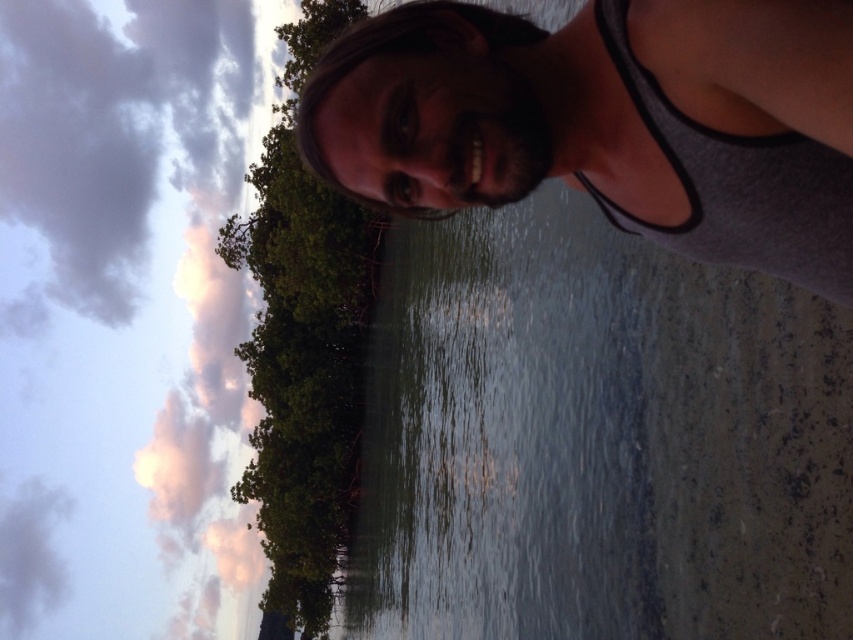
You are an artist trying to paint the sunset scene. You want to ensure the pink fluffy cloud at upper left and the green leafy tree at center are proportionally accurate. Which object should you draw larger?

The pink fluffy cloud at upper left should be drawn larger than the green leafy tree at center because it is bigger according to the description.

You are an astronomer observing the sky and notice the pink fluffy cloud at upper left and the gray fabric tank top at upper center. Which object is closer to your line of sight?

The pink fluffy cloud at upper left is closer to your line of sight because the gray fabric tank top at upper center is behind it.

You are an artist trying to paint the serene outdoor scene. You notice the gray fabric tank top at upper center and the green leafy tree at center. Which object should you draw first if you want to follow the rule of painting smaller objects before larger ones?

The gray fabric tank top at upper center should be drawn first because its width is less than the green leafy tree at center, making it smaller in size.